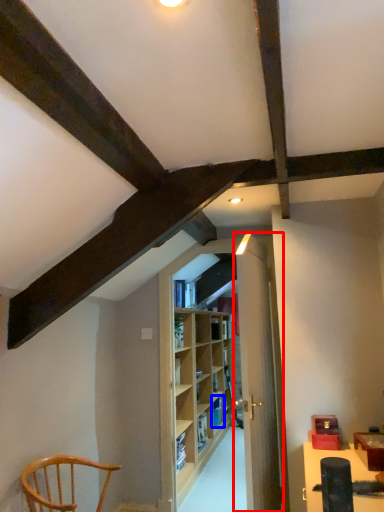
Question: Which of the following is the farthest to the observer, door (highlighted by a red box) or shelf (highlighted by a blue box)?

Choices:
 (A) door
 (B) shelf

Answer: (B)